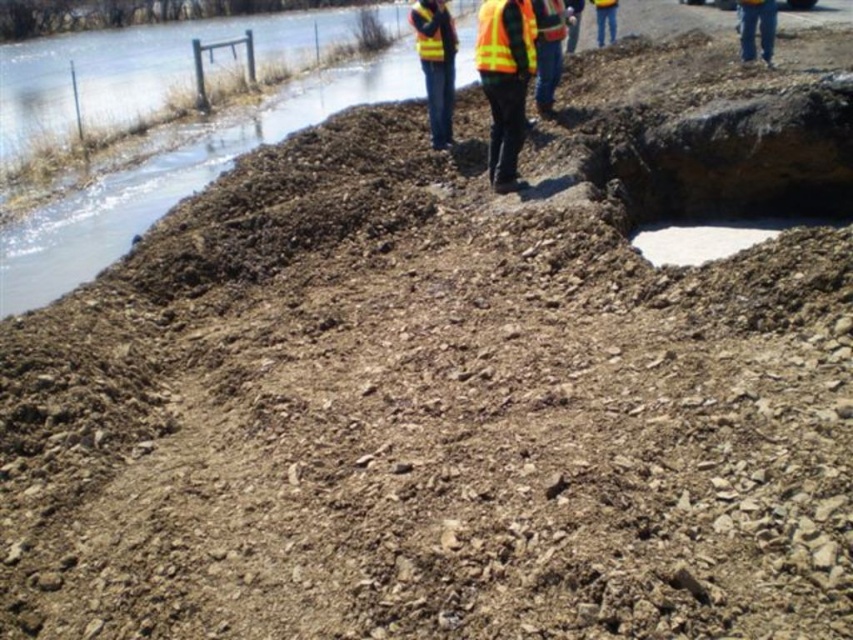
Between white smooth concrete at center and high-visibility fabric safety vest at center, which one appears on the left side from the viewer's perspective?

From the viewer's perspective, high-visibility fabric safety vest at center appears more on the left side.

Describe the element at coordinates (718, 186) in the screenshot. I see `white smooth concrete at center` at that location.

Find the location of a particular element. This screenshot has height=640, width=853. white smooth concrete at center is located at coordinates tap(718, 186).

Does high-visibility reflective vest at center have a lesser height compared to yellow reflective safety vest at upper center?

Incorrect, high-visibility reflective vest at center's height does not fall short of yellow reflective safety vest at upper center's.

Image resolution: width=853 pixels, height=640 pixels. Describe the element at coordinates (505, 81) in the screenshot. I see `high-visibility reflective vest at center` at that location.

Find the location of a particular element. high-visibility reflective vest at center is located at coordinates (505, 81).

Who is more distant from viewer, (450,140) or (442,4)?

The point (450,140) is behind.

Does yellow reflective vest at center have a greater height compared to yellow reflective safety vest at upper center?

Indeed, yellow reflective vest at center has a greater height compared to yellow reflective safety vest at upper center.

The image size is (853, 640). Identify the location of yellow reflective vest at center. (436, 65).

Locate an element on the screen. The width and height of the screenshot is (853, 640). yellow reflective vest at center is located at coordinates (436, 65).